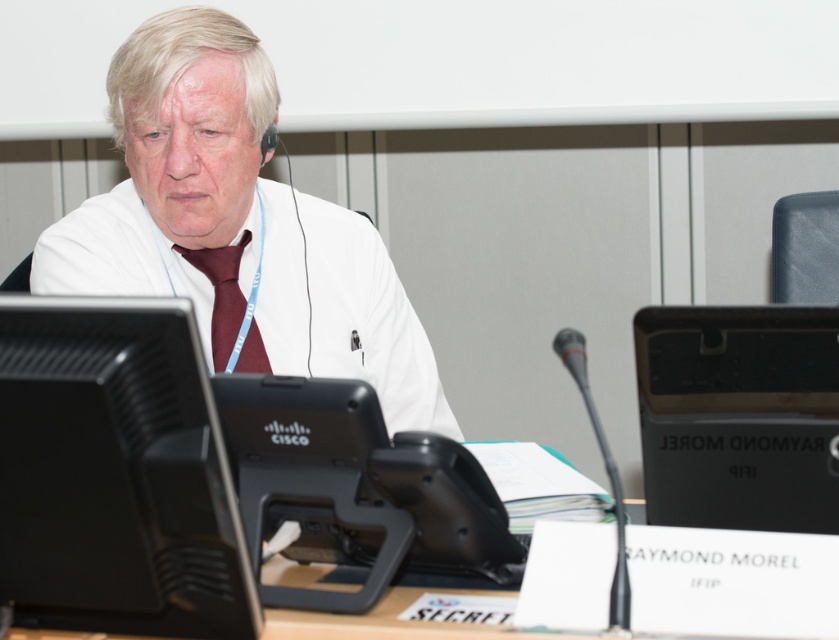
Question: Which of the following is the closest to the observer?

Choices:
 (A) (202, 499)
 (B) (679, 445)

Answer: (A)

Question: Is white matte lab coat at center closer to camera compared to black plastic desktop computer at right?

Choices:
 (A) no
 (B) yes

Answer: (A)

Question: Can you confirm if white matte lab coat at center is positioned below black plastic desktop computer at right?

Choices:
 (A) yes
 (B) no

Answer: (B)

Question: Which object is closer to the camera taking this photo?

Choices:
 (A) burgundy satin tie at center
 (B) white matte lab coat at center

Answer: (B)

Question: Does black glossy monitor at left have a greater width compared to black plastic desktop computer at right?

Choices:
 (A) no
 (B) yes

Answer: (B)

Question: Which object is positioned farthest from the burgundy satin tie at center?

Choices:
 (A) black glossy monitor at left
 (B) white matte lab coat at center
 (C) black plastic desktop computer at right

Answer: (C)